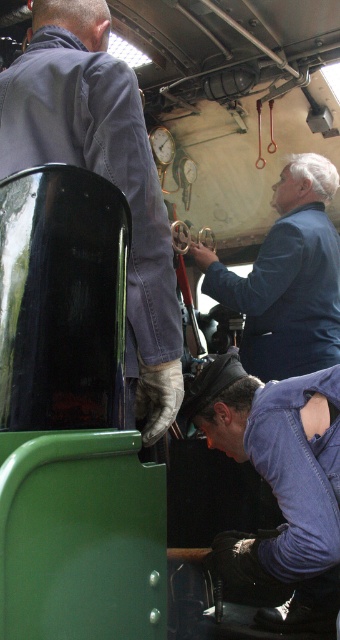
You are inside the steam locomotive cab and need to reach the control panel located at point (309, 298). There is an object at point (324, 465) blocking your path. Can you walk around it to reach the control panel?

Point (324, 465) is in front of point (309, 298), so you can walk around it to reach the control panel at point (309, 298).

You are a passenger in the vintage steam locomotive cab and need to locate the emergency brake handle. The handle is positioned between the denim jacket at upper left and the blue matte jacket at upper center. Which jacket is closer to the emergency brake handle?

The denim jacket at upper left is taller than the blue matte jacket at upper center, so the emergency brake handle is closer to the denim jacket at upper left since it is positioned higher up.

You are standing in the vintage steam locomotive cab and need to locate the dark blue denim jeans at lower center. According to the coordinates provided, where exactly should you look?

The dark blue denim jeans at lower center can be found at the coordinates point (279, 477).